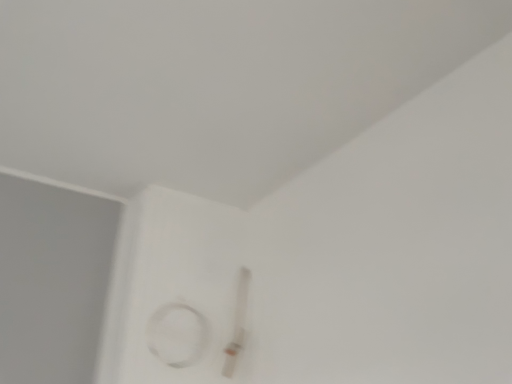
Find the location of a particular element. white glossy circle at lower center is located at coordinates (177, 335).

What do you see at coordinates (177, 335) in the screenshot?
I see `white glossy circle at lower center` at bounding box center [177, 335].

Identify the location of white glossy circle at lower center. (177, 335).